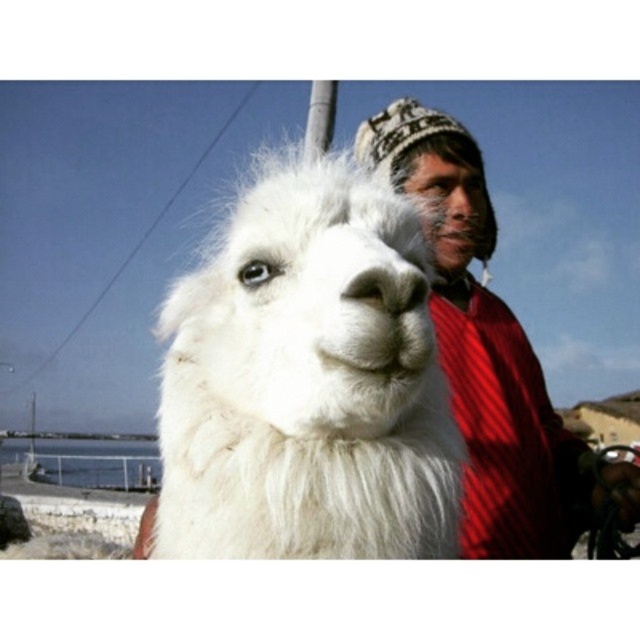
Which is more to the right, white fluffy alpaca at center or knitted woolen hat at upper right?

Positioned to the right is knitted woolen hat at upper right.

Between white fluffy alpaca at center and knitted woolen hat at upper right, which one has more height?

knitted woolen hat at upper right

This screenshot has width=640, height=640. Identify the location of white fluffy alpaca at center. click(305, 381).

Identify the location of white fluffy alpaca at center. The width and height of the screenshot is (640, 640). (305, 381).